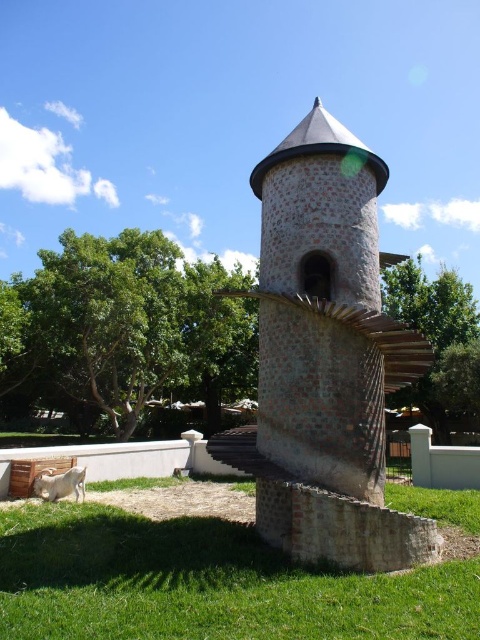
You are standing at the base of the tower and want to reach the gate located at the lower part of the image. You notice two points marked on the path. Which point, point (453, 593) or point (80, 493), is closer to the gate?

Point (80, 493) is closer to the gate because it is located lower in the image, which aligns with the gate being at the base of the tower.

You are a visitor at this site and want to take a photo of the brown stone water tower at center and the white woolen goat at lower left together in the same frame. Based on their positions, which direction should you face to include both in your photo?

Since the brown stone water tower at center is to the right of the white woolen goat at lower left, you should face towards the right side of the white woolen goat at lower left to include both in the same frame.

You are standing at the base of the tower and see the green grass at lower center and the green leafy tree at upper left. From your perspective, which object is positioned to the right of the other?

The green grass at lower center is to the right of the green leafy tree at upper left.